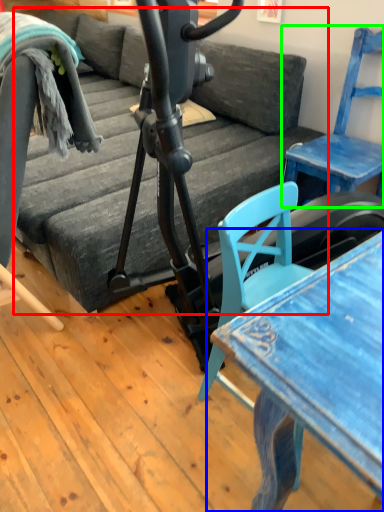
Question: Based on their relative distances, which object is farther from studio couch (highlighted by a red box)? Choose from table (highlighted by a blue box) and chair (highlighted by a green box).

Choices:
 (A) table
 (B) chair

Answer: (A)